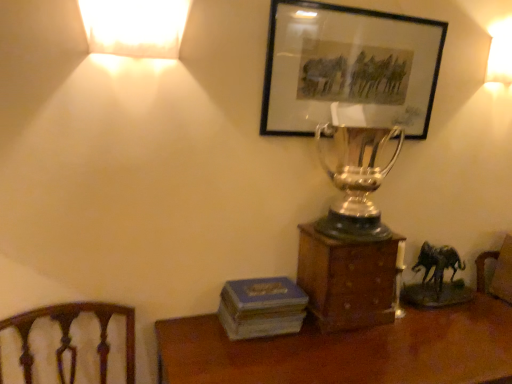
Image resolution: width=512 pixels, height=384 pixels. In order to click on unoccupied area in front of blue matte book at lower center in this screenshot , I will do `click(263, 360)`.